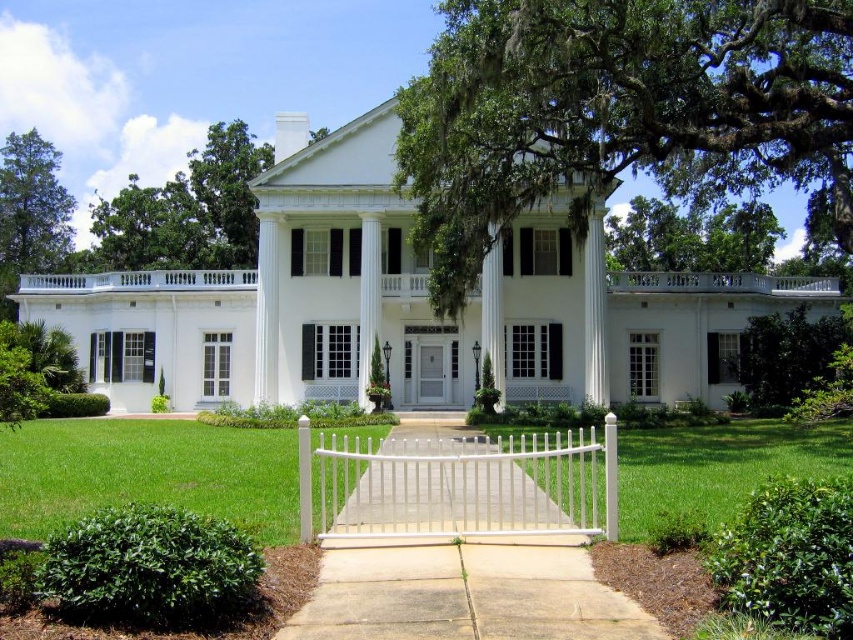
You are a gardener who needs to mow the lawn. Your lawnmower is 2 feet wide. There is a white vinyl gate at center that you must pass through to reach the green grass at center. Can your lawnmower fit through the gate to access the grass?

The distance between the green grass at center and white vinyl gate at center is 11.35 feet. Since the lawnmower is only 2 feet wide, it can easily pass through the gate to reach the grass.

You are standing in front of the mansion and want to walk towards the white glossy column at center. However, there is green grass at center in your path. Can you walk directly to the column without stepping on the grass?

The green grass at center is positioned under the white glossy column at center, so you can walk directly to the column without stepping on the grass because the grass is located beneath it, not in front.

You are a gardener planning to plant flowers in the front yard of the mansion. You have two options for planting areas. One is the green grass at center and the other is the white vinyl gate at center. Which area would you choose if you want to plant more flowers?

The green grass at center is larger in size than the white vinyl gate at center, so you should choose the green grass at center to plant more flowers.